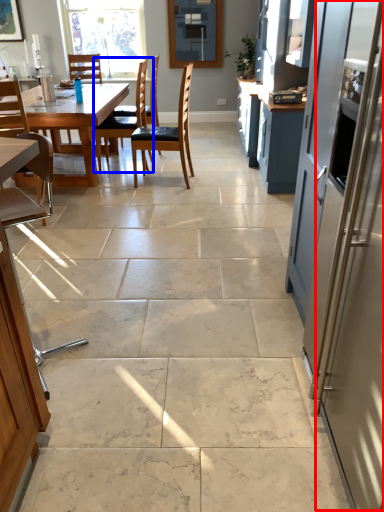
Question: Which of the following is the closest to the observer, screen door (highlighted by a red box) or chair (highlighted by a blue box)?

Choices:
 (A) screen door
 (B) chair

Answer: (A)